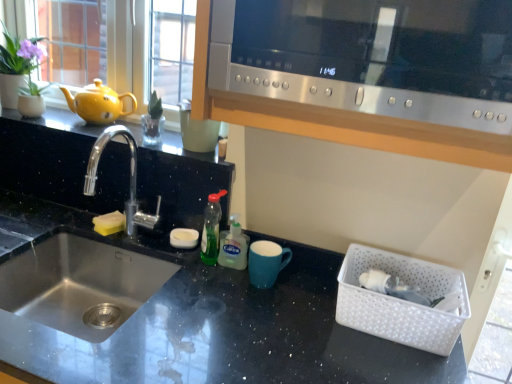
Locate an element on the screen. The image size is (512, 384). vacant space that is to the left of yellow sponge at sink is located at coordinates (50, 220).